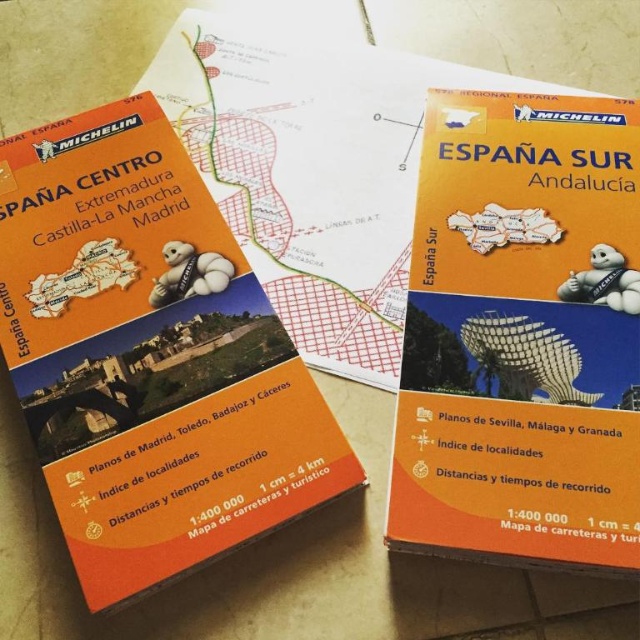
You are planning a road trip and see the orange matte map at upper right and the metallic bird at center in the image. Which map is positioned closer to the right edge of the image?

The metallic bird at center is positioned to the right of the orange matte map at upper right, so the metallic bird at center is closer to the right edge of the image.

You are a traveler planning a road trip in Spain. You have two maps in front of you, the orange matte map at upper right and the metallic bird at center. Which map should you choose to plan your route through Andalucia?

The orange matte map at upper right is the correct choice for planning your route through Andalucia because it is labeled as the larger map, which typically provides more detailed information for navigation compared to the smaller metallic bird at center.